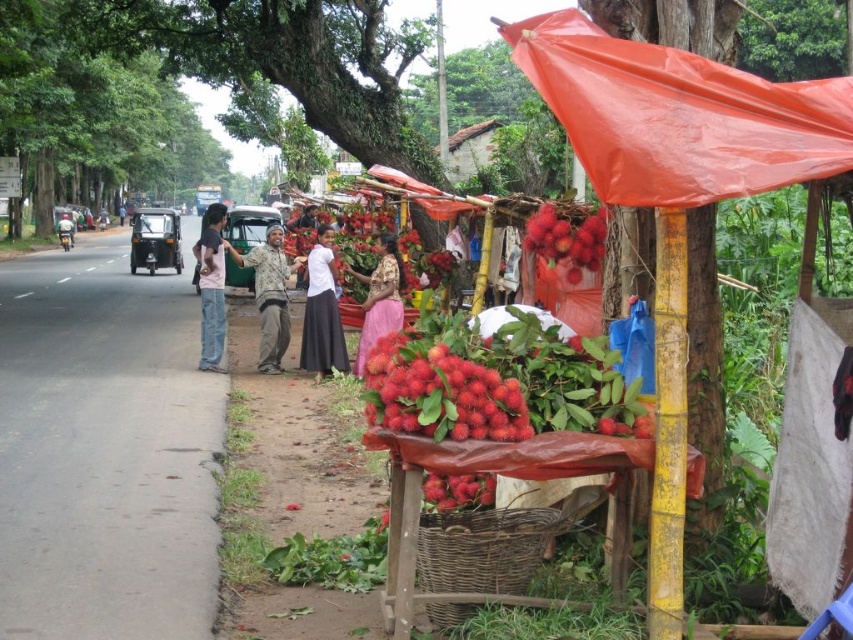
Question: Does jeans at left appear on the left side of shiny red rambutan at center?

Choices:
 (A) yes
 (B) no

Answer: (A)

Question: Estimate the real-world distances between objects in this image. Which object is closer to the woven brown basket at lower center?

Choices:
 (A) red fuzzy rambutan at center
 (B) green fabric motorcycle at left
 (C) fuzzy red rambutan at center

Answer: (C)

Question: Estimate the real-world distances between objects in this image. Which object is closer to the jeans at left?

Choices:
 (A) red fuzzy rambutan at center
 (B) woven brown basket at lower center
 (C) pink satin dress at center
 (D) white matte skirt at center

Answer: (D)

Question: Is red fuzzy rambutan at center below green fabric motorcycle at left?

Choices:
 (A) yes
 (B) no

Answer: (A)

Question: Is jeans at left further to camera compared to pink satin dress at center?

Choices:
 (A) yes
 (B) no

Answer: (A)

Question: Which point is closer to the camera taking this photo?

Choices:
 (A) (332, 323)
 (B) (396, 428)
 (C) (287, 269)

Answer: (B)